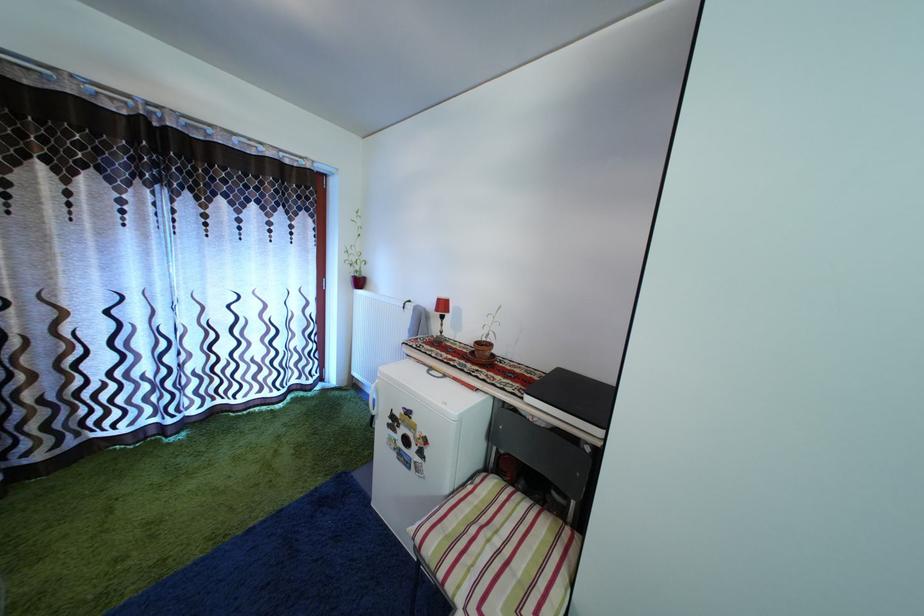
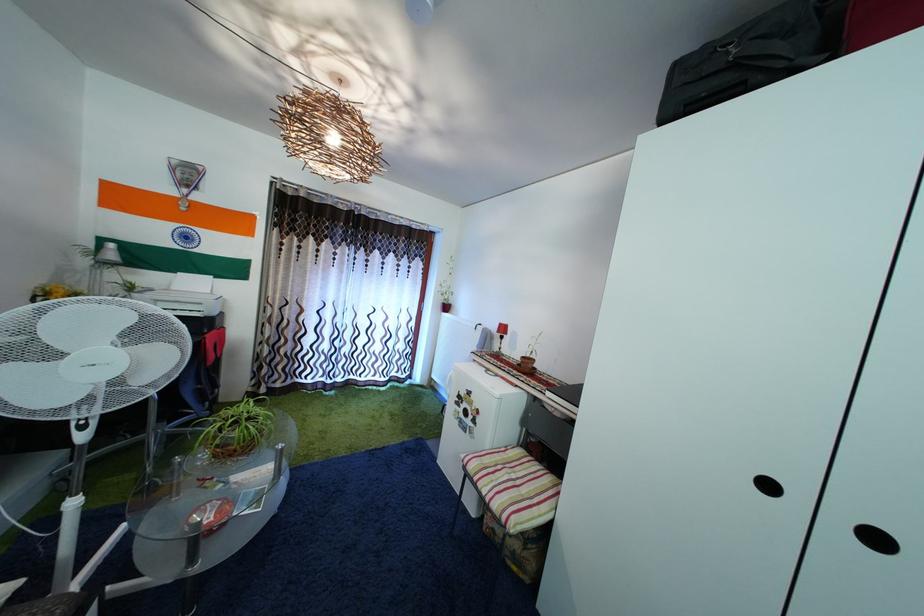
Question: The first image is from the beginning of the video and the second image is from the end. How did the camera likely rotate when shooting the video?

Choices:
 (A) Left
 (B) Right
 (C) Up
 (D) Down

Answer: (A)